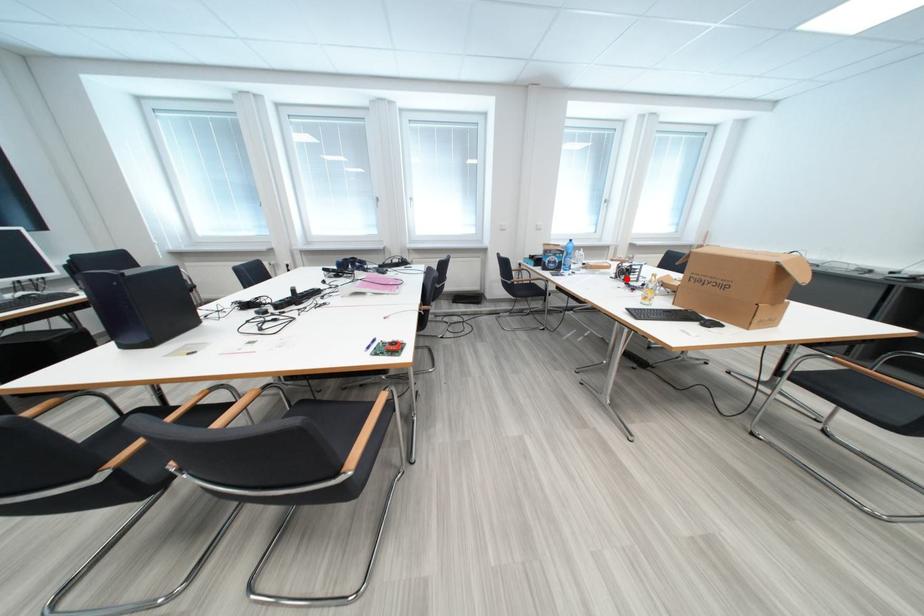
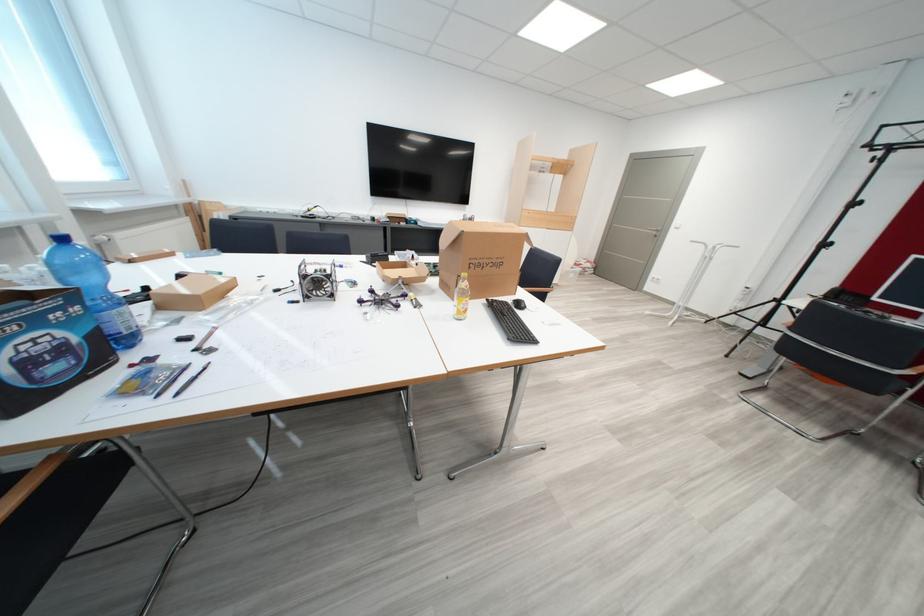
Question: I am providing you with two images of the same scene from different viewpoints. A red point is marked on the first image. Is the red point's position out of view in image 2?

Choices:
 (A) Yes
 (B) No

Answer: (B)